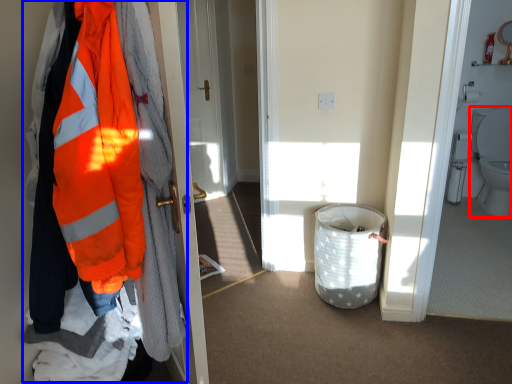
Question: Which of the following is the closest to the observer, toilet (highlighted by a red box) or jacket (highlighted by a blue box)?

Choices:
 (A) toilet
 (B) jacket

Answer: (B)